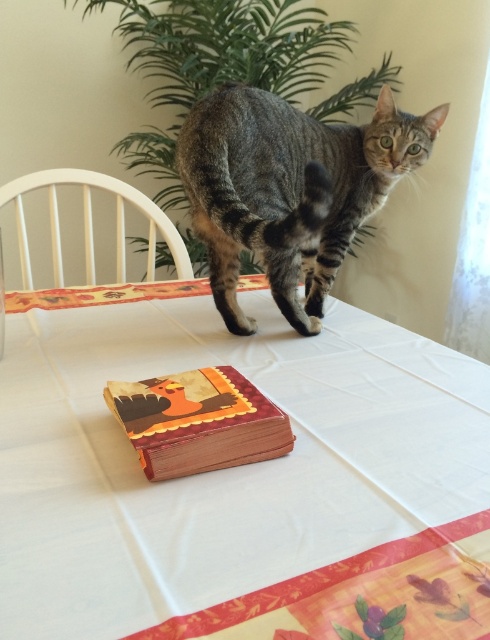
Consider the image. Is white cloth at center behind wooden book at center?

No, it is in front of wooden book at center.

Does point (98, 490) lie in front of point (108, 388)?

Yes.

Does point (424, 561) lie in front of point (204, 452)?

Yes, it is in front of point (204, 452).

Where is `white cloth at center`? The width and height of the screenshot is (490, 640). white cloth at center is located at coordinates (239, 477).

Which of these two, white cloth at center or tabby fur cat at center, stands shorter?

white cloth at center is shorter.

Which is behind, point (87, 580) or point (382, 144)?

The point (382, 144) is behind.

What are the coordinates of `white cloth at center` in the screenshot? It's located at (239, 477).

At what (x,y) coordinates should I click in order to perform the action: click on white cloth at center. Please return your answer as a coordinate pair (x, y). Looking at the image, I should click on (239, 477).

How distant is tabby fur cat at center from wooden book at center?

A distance of 12.70 inches exists between tabby fur cat at center and wooden book at center.

Is tabby fur cat at center thinner than wooden book at center?

No, tabby fur cat at center is not thinner than wooden book at center.

Find the location of a particular element. tabby fur cat at center is located at coordinates (290, 189).

Where is `tabby fur cat at center`? tabby fur cat at center is located at coordinates (290, 189).